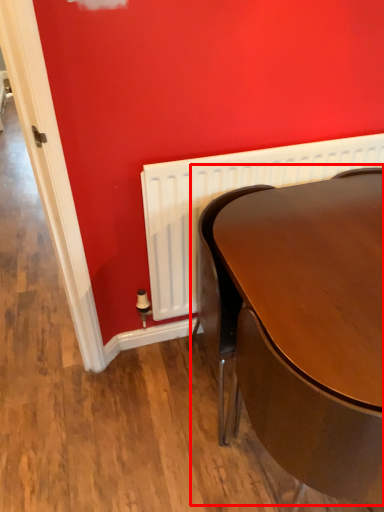
Question: From the image's perspective, what is the correct spatial positioning of table (annotated by the red box) in reference to radiator?

Choices:
 (A) below
 (B) above

Answer: (A)